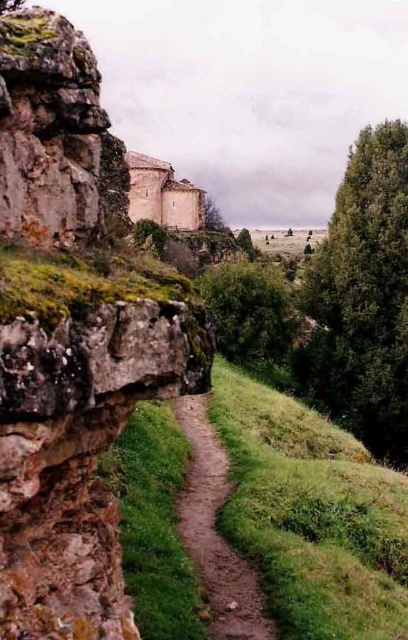
You are a hiker planning to walk along the brown dirt path at center and pass by the green leafy tree at center. Which of these two objects takes up more space in the image?

The green leafy tree at center takes up more space in the image than the brown dirt path at center because the brown dirt path at center is smaller than the green leafy tree at center.

You are a hiker who wants to reach the white stone fort at center from the brown dirt path at center. Which direction should you move relative to the path to reach the fort?

The brown dirt path at center is positioned under the white stone fort at center, so you should move upward from the path to reach the fort.

Consider the image. You are standing at the base of the cliff and want to reach the point marked at coordinates (175,406). Given that the distance from your current position to that point is 87.28 meters, is this distance within a comfortable walking range for most people?

The distance to the point is 87.28 meters, which is about 95 yards. Most people can comfortably walk this distance, so yes, it is within a comfortable walking range.